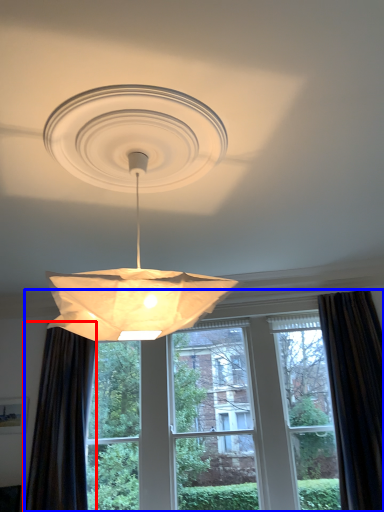
Question: Which of the following is the farthest to the observer, curtain (highlighted by a red box) or window (highlighted by a blue box)?

Choices:
 (A) curtain
 (B) window

Answer: (B)